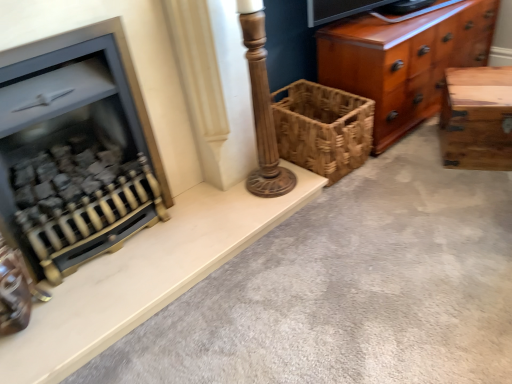
Question: Is shiny brown wood chest of drawers at right thinner than natural wood trunk at right?

Choices:
 (A) no
 (B) yes

Answer: (B)

Question: Does shiny brown wood chest of drawers at right come in front of natural wood trunk at right?

Choices:
 (A) no
 (B) yes

Answer: (A)

Question: Are shiny brown wood chest of drawers at right and natural wood trunk at right far apart?

Choices:
 (A) no
 (B) yes

Answer: (A)

Question: From a real-world perspective, is shiny brown wood chest of drawers at right beneath natural wood trunk at right?

Choices:
 (A) yes
 (B) no

Answer: (B)

Question: Considering the relative positions of shiny brown wood chest of drawers at right and natural wood trunk at right in the image provided, is shiny brown wood chest of drawers at right to the left of natural wood trunk at right from the viewer's perspective?

Choices:
 (A) no
 (B) yes

Answer: (B)

Question: Considering their positions, is matte black fireplace at left located in front of or behind natural wood trunk at right?

Choices:
 (A) front
 (B) behind

Answer: (A)

Question: Considering the positions of matte black fireplace at left and natural wood trunk at right in the image, is matte black fireplace at left bigger or smaller than natural wood trunk at right?

Choices:
 (A) small
 (B) big

Answer: (B)

Question: Is matte black fireplace at left wider or thinner than natural wood trunk at right?

Choices:
 (A) wide
 (B) thin

Answer: (B)

Question: Considering the relative positions of matte black fireplace at left and natural wood trunk at right in the image provided, is matte black fireplace at left to the left or to the right of natural wood trunk at right?

Choices:
 (A) right
 (B) left

Answer: (B)

Question: From their relative heights in the image, would you say shiny brown wood chest of drawers at right is taller or shorter than matte black fireplace at left?

Choices:
 (A) tall
 (B) short

Answer: (B)

Question: Considering the positions of shiny brown wood chest of drawers at right and matte black fireplace at left in the image, is shiny brown wood chest of drawers at right wider or thinner than matte black fireplace at left?

Choices:
 (A) wide
 (B) thin

Answer: (A)

Question: Choose the correct answer: Is shiny brown wood chest of drawers at right inside matte black fireplace at left or outside it?

Choices:
 (A) outside
 (B) inside

Answer: (A)

Question: Is shiny brown wood chest of drawers at right in front of or behind matte black fireplace at left in the image?

Choices:
 (A) behind
 (B) front

Answer: (A)

Question: From a real-world perspective, relative to woven brown basket at center, is natural wood trunk at right vertically above or below?

Choices:
 (A) below
 (B) above

Answer: (A)

Question: Is point (510, 140) closer or farther from the camera than point (330, 173)?

Choices:
 (A) farther
 (B) closer

Answer: (B)